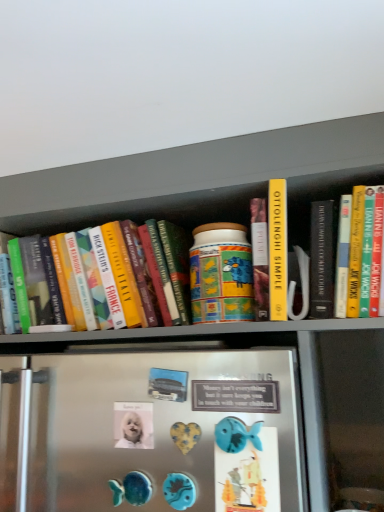
Question: Does point (253, 462) appear closer or farther from the camera than point (175, 313)?

Choices:
 (A) closer
 (B) farther

Answer: (A)

Question: Do you think blue plastic fish at lower center, which is counted as the first button, starting from the front, is within hardcover book at left, or outside of it?

Choices:
 (A) inside
 (B) outside

Answer: (B)

Question: Which object is positioned farthest from the hardcover book at left?

Choices:
 (A) white glossy button at center, which ranks as the second button in right-to-left order
 (B) blue plastic fish at lower center, placed as the 1th button when sorted from right to left

Answer: (B)

Question: Considering the real-world distances, which object is closest to the blue plastic fish at lower center, the 2th button when ordered from left to right?

Choices:
 (A) white glossy button at center, arranged as the 2th button when viewed from the front
 (B) hardcover book at left

Answer: (A)